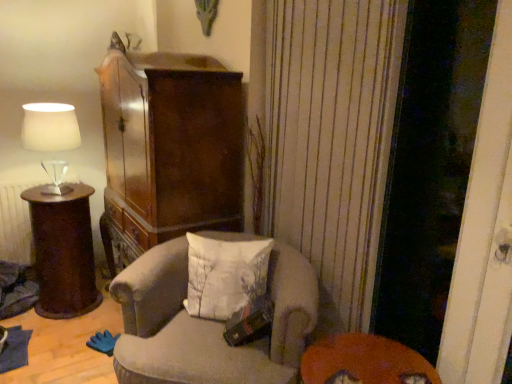
This screenshot has height=384, width=512. What do you see at coordinates (430, 166) in the screenshot? I see `transparent glass screen door at right` at bounding box center [430, 166].

Measure the distance between point (65,265) and camera.

Point (65,265) is 2.45 meters from camera.

Identify the location of white fabric pillow at center. The height and width of the screenshot is (384, 512). (225, 275).

Describe the element at coordinates (364, 361) in the screenshot. This screenshot has width=512, height=384. I see `orange felt table at lower right` at that location.

Identify the location of velvet beige armchair at center. (207, 323).

Locate an element on the screen. This screenshot has width=512, height=384. transparent glass screen door at right is located at coordinates (430, 166).

From a real-world perspective, is transparent glass screen door at right on top of velvet beige armchair at center?

Correct, in the physical world, transparent glass screen door at right is higher than velvet beige armchair at center.

Is transparent glass screen door at right situated inside velvet beige armchair at center or outside?

transparent glass screen door at right exists outside the volume of velvet beige armchair at center.

In terms of height, does transparent glass screen door at right look taller or shorter compared to velvet beige armchair at center?

Considering their sizes, transparent glass screen door at right has more height than velvet beige armchair at center.

From the image's perspective, would you say transparent glass screen door at right is positioned over velvet beige armchair at center?

Yes, from the image's perspective, transparent glass screen door at right is above velvet beige armchair at center.

Which is behind, point (237, 253) or point (397, 375)?

The point (237, 253) is farther from the camera.

Between white fabric pillow at center and orange felt table at lower right, which one has smaller width?

Thinner between the two is white fabric pillow at center.

Is the position of white fabric pillow at center more distant than that of orange felt table at lower right?

That is True.

In the image, is white fabric lampshade at left positioned in front of or behind dark brown polished wood side table at left?

white fabric lampshade at left is positioned closer to the viewer than dark brown polished wood side table at left.

Is white fabric lampshade at left not within dark brown polished wood side table at left?

Yes, white fabric lampshade at left is outside of dark brown polished wood side table at left.

Looking at the image, does white fabric lampshade at left seem bigger or smaller compared to dark brown polished wood side table at left?

In the image, white fabric lampshade at left appears to be smaller than dark brown polished wood side table at left.

Consider the image. Can you see white fabric lampshade at left touching dark brown polished wood side table at left?

No, white fabric lampshade at left is not making contact with dark brown polished wood side table at left.

From a real-world perspective, is velvet beige armchair at center on white fabric pillow at center?

No.

How distant is velvet beige armchair at center from white fabric pillow at center?

velvet beige armchair at center and white fabric pillow at center are 5.88 inches apart from each other.

What's the angular difference between velvet beige armchair at center and white fabric pillow at center's facing directions?

The angular difference between velvet beige armchair at center and white fabric pillow at center is 7.26 degrees.

From the image's perspective, is velvet beige armchair at center on top of white fabric pillow at center?

Incorrect, from the image's perspective, velvet beige armchair at center is lower than white fabric pillow at center.

From a real-world perspective, is white fabric pillow at center physically located above or below transparent glass screen door at right?

white fabric pillow at center is below transparent glass screen door at right.

Looking at this image, considering the positions of objects white fabric pillow at center and transparent glass screen door at right in the image provided, who is more to the left, white fabric pillow at center or transparent glass screen door at right?

From the viewer's perspective, white fabric pillow at center appears more on the left side.

Is white fabric pillow at center far from transparent glass screen door at right?

white fabric pillow at center is near transparent glass screen door at right, not far away.

Are white fabric pillow at center and white fabric lampshade at left beside each other?

white fabric pillow at center and white fabric lampshade at left are clearly separated.

Which object is thinner, white fabric pillow at center or white fabric lampshade at left?

white fabric pillow at center.

Looking at this image, how much distance is there between white fabric pillow at center and white fabric lampshade at left?

The distance of white fabric pillow at center from white fabric lampshade at left is 1.17 meters.

Would you say white fabric pillow at center contains white fabric lampshade at left?

No, white fabric lampshade at left is not inside white fabric pillow at center.

Can you see white fabric lampshade at left touching velvet beige armchair at center?

No.

Which point is more distant from viewer, (40, 142) or (198, 327)?

Point (40, 142)

Considering the positions of objects white fabric lampshade at left and velvet beige armchair at center in the image provided, who is more to the left, white fabric lampshade at left or velvet beige armchair at center?

white fabric lampshade at left is more to the left.

Looking at this image, from the image's perspective, is white fabric lampshade at left beneath velvet beige armchair at center?

No, from the image's perspective, white fabric lampshade at left is not below velvet beige armchair at center.

The width and height of the screenshot is (512, 384). Find the location of `screen door located above the velvet beige armchair at center (from a real-world perspective)`. screen door located above the velvet beige armchair at center (from a real-world perspective) is located at coordinates (430, 166).

Identify the location of pillow that is behind the orange felt table at lower right. This screenshot has width=512, height=384. (225, 275).

Which object lies nearer to the anchor point white fabric lampshade at left, transparent glass screen door at right or dark brown polished wood side table at left?

dark brown polished wood side table at left is closer to white fabric lampshade at left.

Which object lies further to the anchor point orange felt table at lower right, dark brown polished wood side table at left or white fabric pillow at center?

Based on the image, dark brown polished wood side table at left appears to be further to orange felt table at lower right.

Which object lies further to the anchor point orange felt table at lower right, white fabric pillow at center or white fabric lampshade at left?

white fabric lampshade at left.

Estimate the real-world distances between objects in this image. Which object is closer to white fabric lampshade at left, velvet beige armchair at center or transparent glass screen door at right?

Based on the image, velvet beige armchair at center appears to be nearer to white fabric lampshade at left.

Looking at the image, which one is located further to dark brown polished wood side table at left, white fabric pillow at center or orange felt table at lower right?

orange felt table at lower right lies further to dark brown polished wood side table at left than the other object.

From the picture: From the image, which object appears to be farther from white fabric lampshade at left, white fabric pillow at center or transparent glass screen door at right?

Based on the image, transparent glass screen door at right appears to be further to white fabric lampshade at left.

Considering their positions, is dark brown polished wood side table at left positioned further to white fabric lampshade at left than transparent glass screen door at right?

transparent glass screen door at right is positioned further to the anchor white fabric lampshade at left.

Which object lies further to the anchor point white fabric lampshade at left, white fabric pillow at center or dark brown polished wood side table at left?

white fabric pillow at center.

The image size is (512, 384). I want to click on chair located between dark brown polished wood side table at left and orange felt table at lower right in the left-right direction, so click(207, 323).

Identify the location of table situated between white fabric pillow at center and transparent glass screen door at right from left to right. (364, 361).

Locate an element on the screen. table between velvet beige armchair at center and transparent glass screen door at right from left to right is located at coordinates (364, 361).

Find the location of `table between white fabric lampshade at left and transparent glass screen door at right in the horizontal direction`. table between white fabric lampshade at left and transparent glass screen door at right in the horizontal direction is located at coordinates (364, 361).